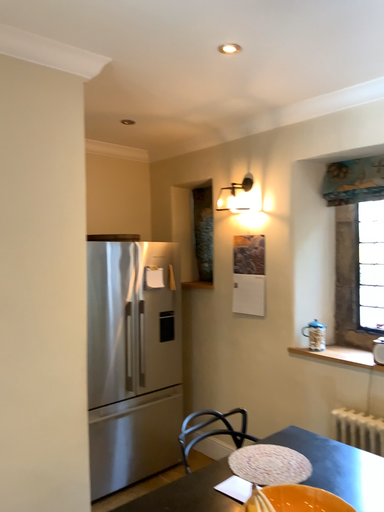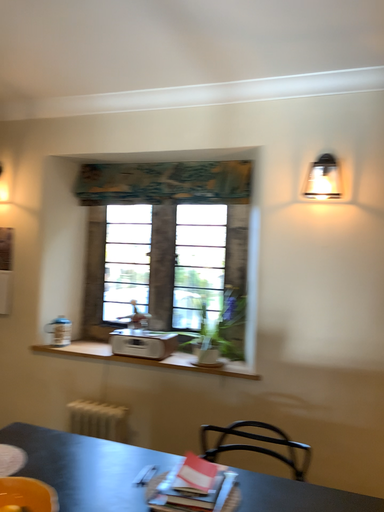
Question: Which way did the camera rotate in the video?

Choices:
 (A) rotated right
 (B) rotated left

Answer: (A)